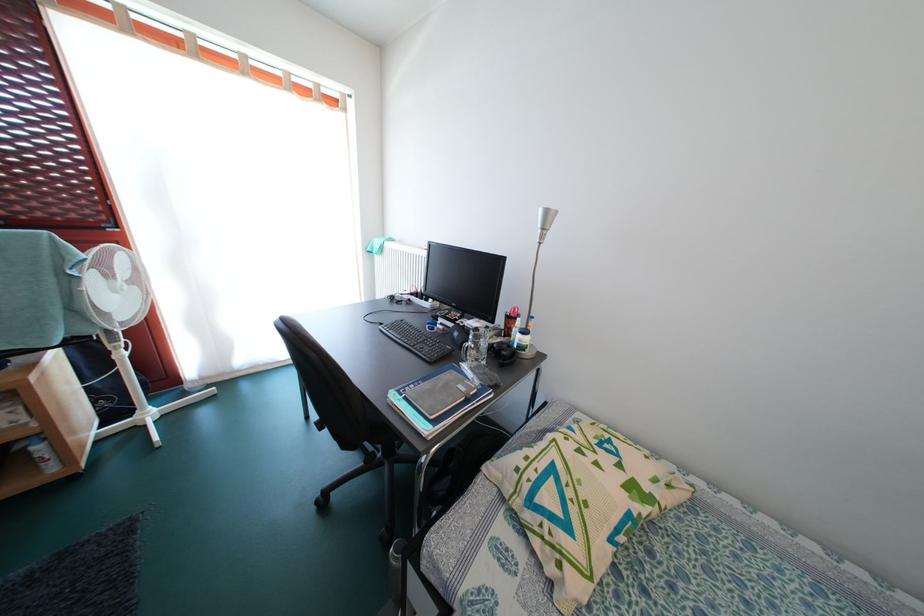
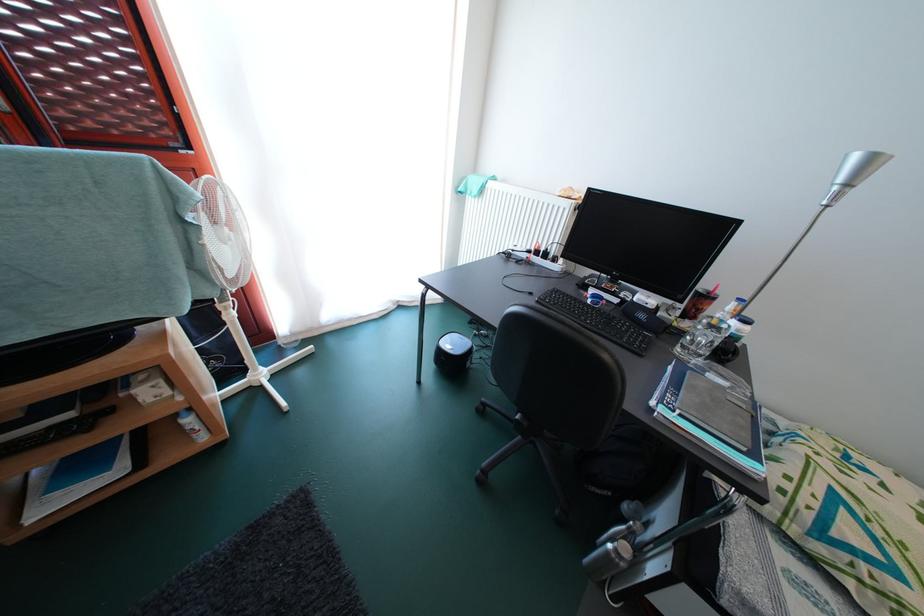
Question: What movement of the cameraman would produce the second image?

Choices:
 (A) Left
 (B) Right
 (C) Forward
 (D) Backward

Answer: (A)